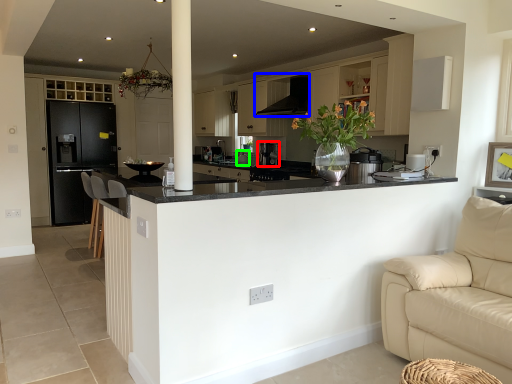
Question: Which object is the closest to the coffee machine (highlighted by a red box)? Choose among these: exhaust hood (highlighted by a blue box) or appliance (highlighted by a green box).

Choices:
 (A) exhaust hood
 (B) appliance

Answer: (B)